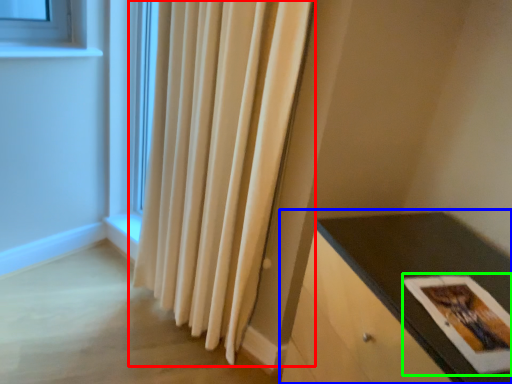
Question: Considering the real-world distances, which object is farthest from curtain (highlighted by a red box)? table (highlighted by a blue box) or postcard (highlighted by a green box)?

Choices:
 (A) table
 (B) postcard

Answer: (B)